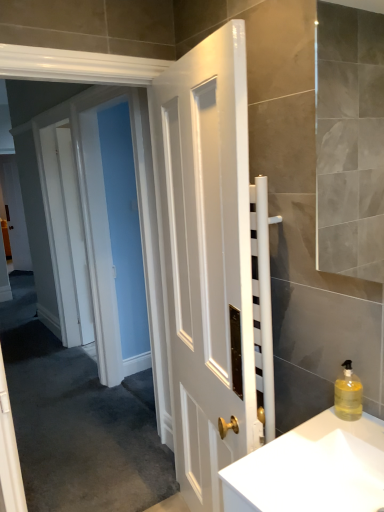
At what (x,y) coordinates should I click in order to perform the action: click on free region on the left part of translucent yellow liquid at right. Please return your answer as a coordinate pair (x, y). The width and height of the screenshot is (384, 512). Looking at the image, I should click on (308, 432).